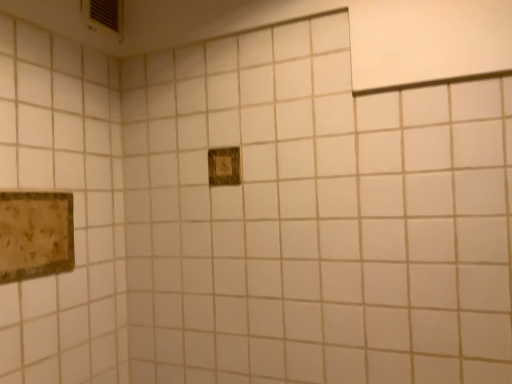
Question: Is the depth of rustic wood picture frame at lower left, the second picture frame from the top, less than that of wooden plaque at center, which is the first picture frame from right to left?

Choices:
 (A) no
 (B) yes

Answer: (B)

Question: Considering the relative sizes of rustic wood picture frame at lower left, which appears as the first picture frame when ordered from the bottom, and wooden plaque at center, which appears as the second picture frame when viewed from the left, in the image provided, is rustic wood picture frame at lower left, which appears as the first picture frame when ordered from the bottom, bigger than wooden plaque at center, which appears as the second picture frame when viewed from the left,?

Choices:
 (A) no
 (B) yes

Answer: (B)

Question: Considering the relative sizes of rustic wood picture frame at lower left, the second picture frame from the top, and wooden plaque at center, which is the 1th picture frame from back to front, in the image provided, is rustic wood picture frame at lower left, the second picture frame from the top, smaller than wooden plaque at center, which is the 1th picture frame from back to front,?

Choices:
 (A) yes
 (B) no

Answer: (B)

Question: Is rustic wood picture frame at lower left, acting as the second picture frame starting from the back, located outside wooden plaque at center, which is the first picture frame from right to left?

Choices:
 (A) yes
 (B) no

Answer: (A)

Question: Is rustic wood picture frame at lower left, marked as the first picture frame in a left-to-right arrangement, taller than wooden plaque at center, which is the 1th picture frame from back to front?

Choices:
 (A) no
 (B) yes

Answer: (B)

Question: From the image's perspective, is rustic wood picture frame at lower left, acting as the second picture frame starting from the back, above wooden plaque at center, which is the 1th picture frame from back to front?

Choices:
 (A) no
 (B) yes

Answer: (A)

Question: From the image's perspective, is wooden plaque at center, the second picture frame when ordered from bottom to top, on top of rustic wood picture frame at lower left, marked as the first picture frame in a left-to-right arrangement?

Choices:
 (A) yes
 (B) no

Answer: (A)

Question: Is wooden plaque at center, which is the 1th picture frame from back to front, positioned beyond the bounds of rustic wood picture frame at lower left, the second picture frame from the top?

Choices:
 (A) no
 (B) yes

Answer: (B)

Question: Is there a large distance between wooden plaque at center, placed as the 2th picture frame when sorted from front to back, and rustic wood picture frame at lower left, the second picture frame from the top?

Choices:
 (A) no
 (B) yes

Answer: (A)

Question: Considering the relative positions of wooden plaque at center, placed as the 2th picture frame when sorted from front to back, and rustic wood picture frame at lower left, which appears as the first picture frame when ordered from the bottom, in the image provided, is wooden plaque at center, placed as the 2th picture frame when sorted from front to back, behind rustic wood picture frame at lower left, which appears as the first picture frame when ordered from the bottom,?

Choices:
 (A) no
 (B) yes

Answer: (B)

Question: Is rustic wood picture frame at lower left, which appears as the first picture frame when ordered from the bottom, completely or partially inside wooden plaque at center, which is the 1th picture frame from back to front?

Choices:
 (A) yes
 (B) no

Answer: (B)

Question: Can you confirm if wooden plaque at center, the first picture frame when ordered from top to bottom, is bigger than rustic wood picture frame at lower left, marked as the first picture frame in a left-to-right arrangement?

Choices:
 (A) no
 (B) yes

Answer: (A)

Question: Is rustic wood picture frame at lower left, the second picture frame from the top, inside the boundaries of wooden plaque at center, which is the 1th picture frame from back to front, or outside?

Choices:
 (A) inside
 (B) outside

Answer: (B)